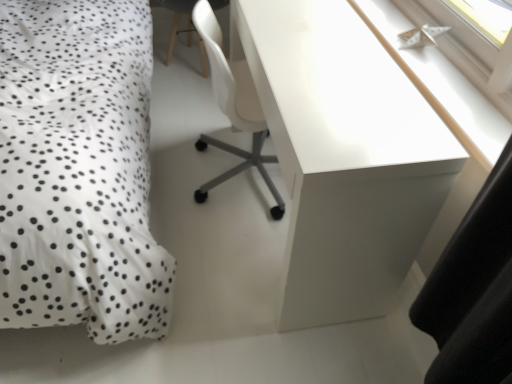
Question: From the image's perspective, is white glossy desk at upper right located above or below white dotted fabric at left?

Choices:
 (A) below
 (B) above

Answer: (A)

Question: Considering the positions of white glossy desk at upper right and white dotted fabric at left in the image, is white glossy desk at upper right taller or shorter than white dotted fabric at left?

Choices:
 (A) short
 (B) tall

Answer: (A)

Question: Estimate the real-world distances between objects in this image. Which object is closer to the white glossy desk at upper right?

Choices:
 (A) white plastic chair at center
 (B) white glossy paper boat at upper right
 (C) white dotted fabric at left

Answer: (B)

Question: Estimate the real-world distances between objects in this image. Which object is closer to the white plastic chair at center?

Choices:
 (A) white glossy desk at upper right
 (B) white dotted fabric at left
 (C) white glossy paper boat at upper right

Answer: (B)